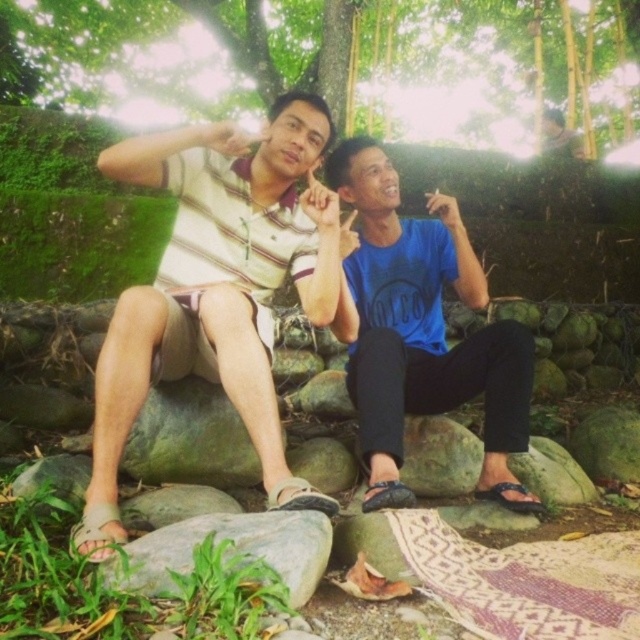
Question: Based on their relative distances, which object is nearer to the gray smooth rock at lower center?

Choices:
 (A) green mossy rock at center
 (B) striped cotton shirt at center
 (C) blue matte shirt at center
 (D) green grass at lower left

Answer: (B)

Question: Does striped cotton shirt at center have a lesser width compared to green grass at lower left?

Choices:
 (A) no
 (B) yes

Answer: (A)

Question: Estimate the real-world distances between objects in this image. Which object is farther from the striped cotton shirt at center?

Choices:
 (A) gray smooth rock at lower center
 (B) blue matte shirt at center
 (C) green grass at lower left

Answer: (C)

Question: Is striped cotton shirt at center bigger than gray smooth rock at lower center?

Choices:
 (A) no
 (B) yes

Answer: (B)

Question: Can you confirm if green leafy tree at upper center is positioned to the left of gray smooth rock at lower center?

Choices:
 (A) no
 (B) yes

Answer: (A)

Question: Estimate the real-world distances between objects in this image. Which object is closer to the blue matte shirt at center?

Choices:
 (A) green mossy rock at lower center
 (B) gray smooth rock at lower center

Answer: (A)